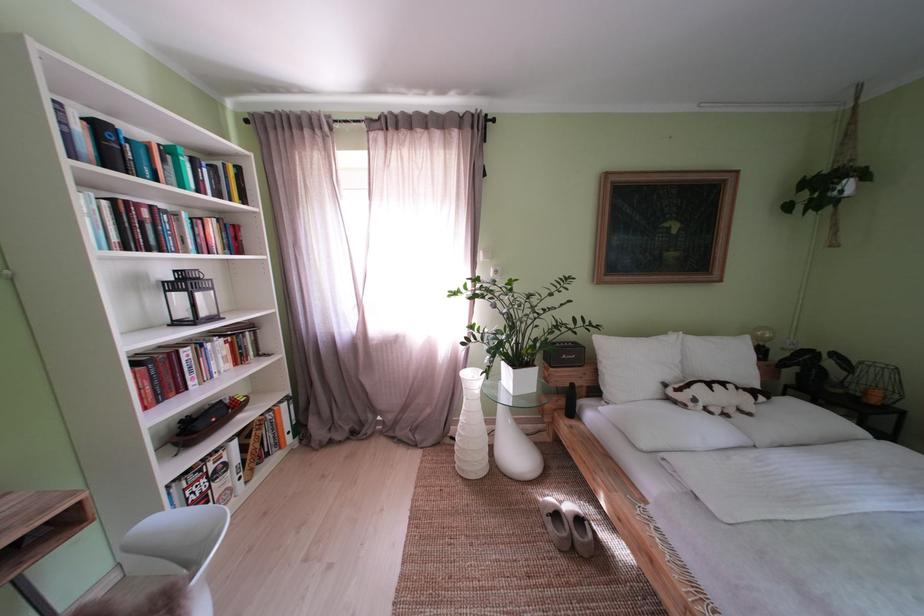
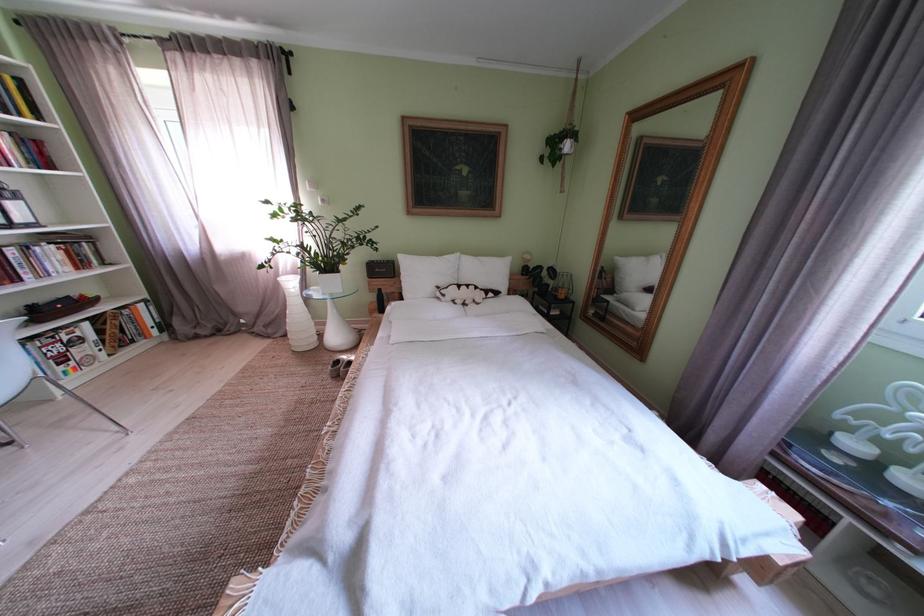
Find the pixel in the second image that matches (x=567, y=521) in the first image.

(348, 367)